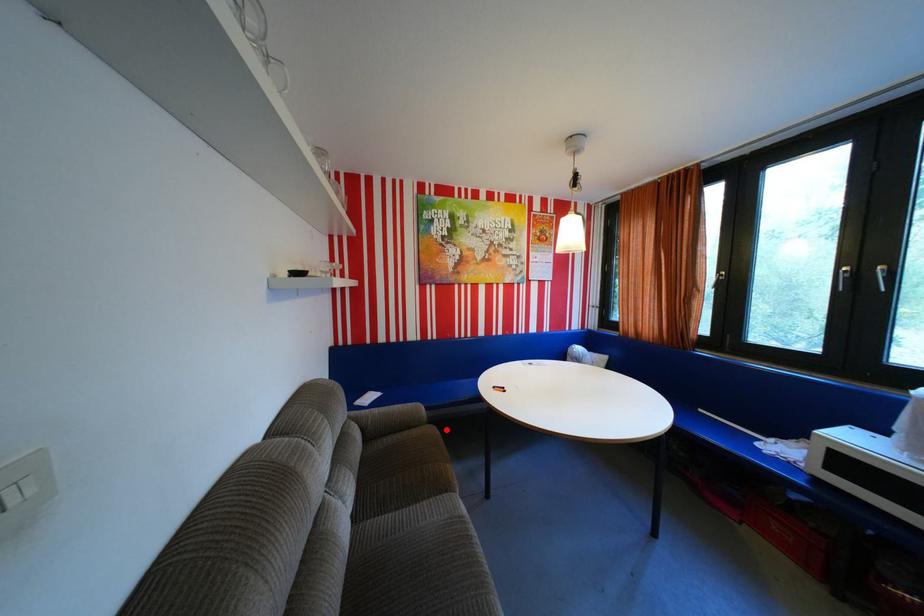
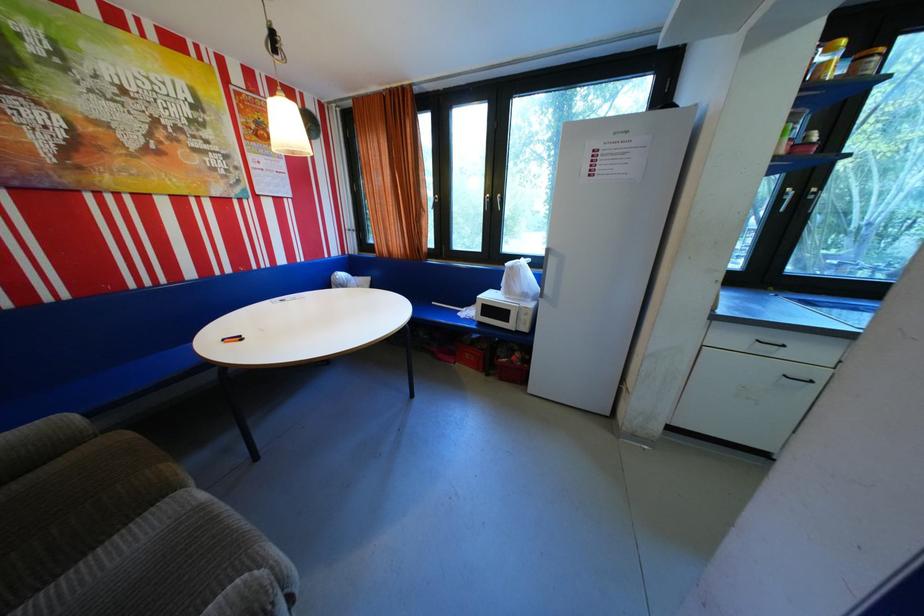
Where in the second image is the point corresponding to the highlighted location from the first image?

(137, 436)